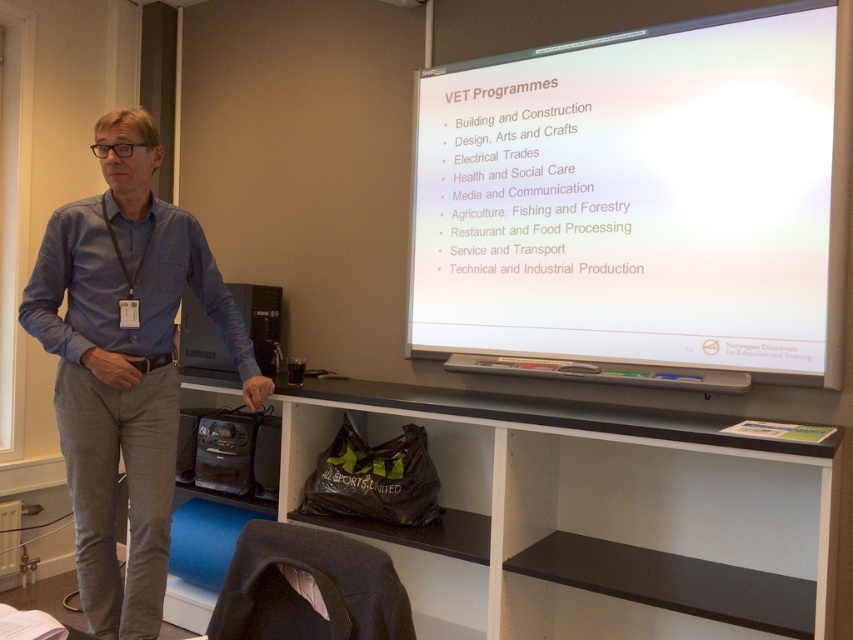
You are standing in front of the presentation screen and want to move closer to the point at coordinates (492, 312) on the screen to read a specific detail. If you can move forward 5 feet, will you be close enough to read the text comfortably?

The point at coordinates (492, 312) is 8.52 feet away from you. Moving forward 5 feet would bring you to 3.52 feet away, which is close enough to read the text comfortably.

You are a student sitting at the front row of the classroom, and you want to reach the white matte projector screen at upper right to adjust the slide. The desk you are sitting at is 0.7 meters wide. Can you step around the desk to reach the screen?

The distance between you and the white matte projector screen at upper right is 1.97 meters. Since the desk is only 0.7 meters wide, you can easily step around it to reach the screen.